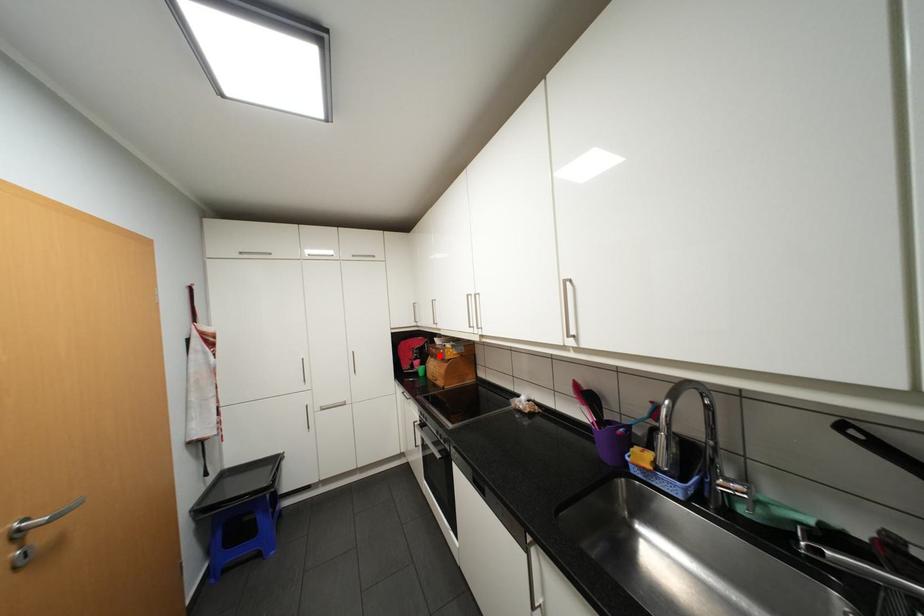
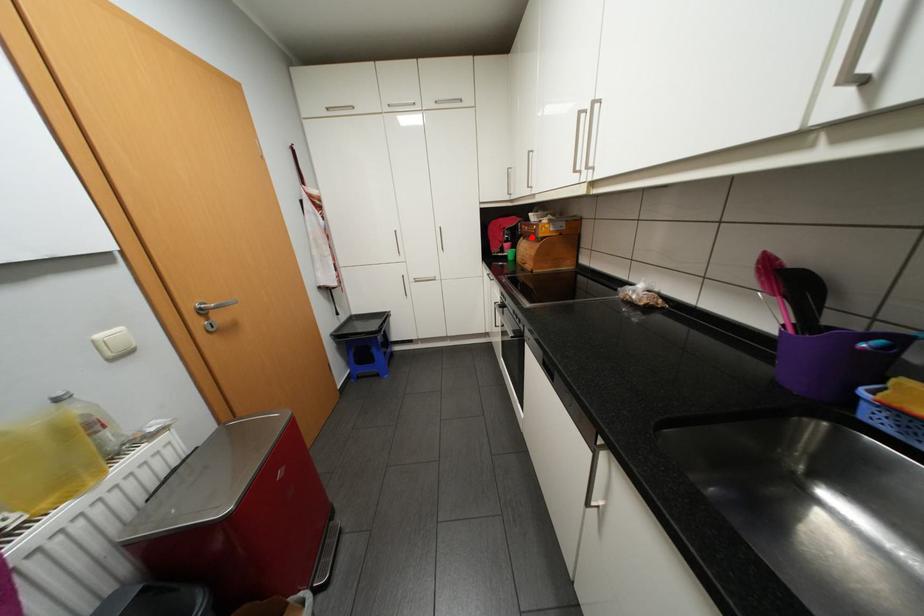
I am providing you with two images of the same scene from different viewpoints. A red point is marked on the first image and another point is marked on the second image. Is the marked point in image1 the same physical position as the marked point in image2?

Yes